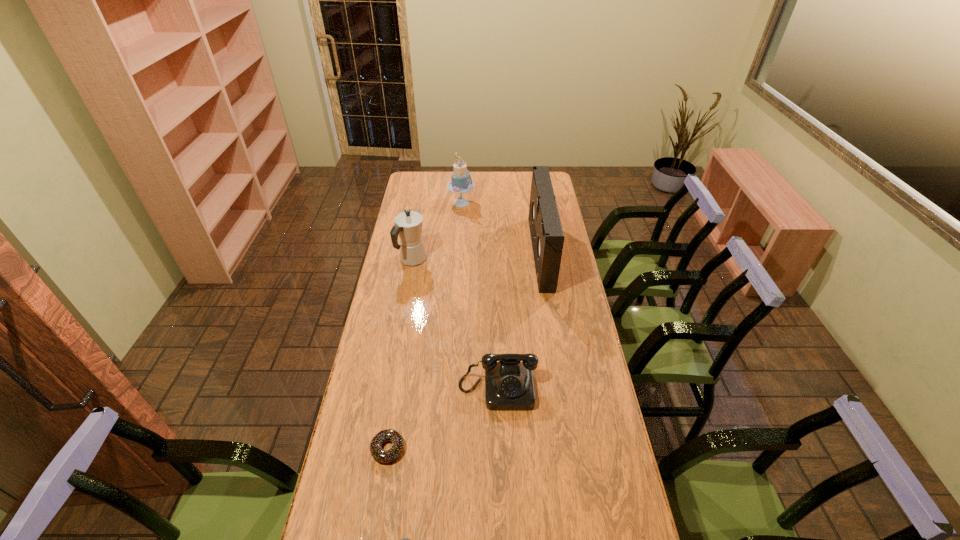
At what (x,y) coordinates should I click in order to perform the action: click on free region located 0.320m with a ladder on the side of the cake. Please return your answer as a coordinate pair (x, y). The image size is (960, 540). Looking at the image, I should click on (535, 203).

In order to click on free space located on the back of the coffeepot in this screenshot , I will do `click(419, 225)`.

Where is `vacant region located 0.350m on the dial of the fourth farthest object`? The image size is (960, 540). vacant region located 0.350m on the dial of the fourth farthest object is located at coordinates (503, 530).

Image resolution: width=960 pixels, height=540 pixels. Find the location of `free spot located 0.160m on the back of the shortest object`. free spot located 0.160m on the back of the shortest object is located at coordinates (397, 389).

I want to click on coffeepot that is at the left edge, so click(x=408, y=225).

You are a GUI agent. You are given a task and a screenshot of the screen. Output one action in this format:
    pyautogui.click(x=<x>, y=<y>)
    Task: Click on the doughnut present at the left edge
    The width and height of the screenshot is (960, 540).
    Given the screenshot: What is the action you would take?
    click(x=384, y=456)

Where is `object that is at the right edge`? object that is at the right edge is located at coordinates (547, 236).

At what (x,y) coordinates should I click in order to perform the action: click on blank space at the far edge. Please return your answer as a coordinate pair (x, y). This screenshot has height=540, width=960. Looking at the image, I should click on (475, 176).

At what (x,y) coordinates should I click in order to perform the action: click on blank space at the left edge of the desktop. Please return your answer as a coordinate pair (x, y). Looking at the image, I should click on (368, 394).

The height and width of the screenshot is (540, 960). Identify the location of blank space at the right edge of the desktop. (605, 504).